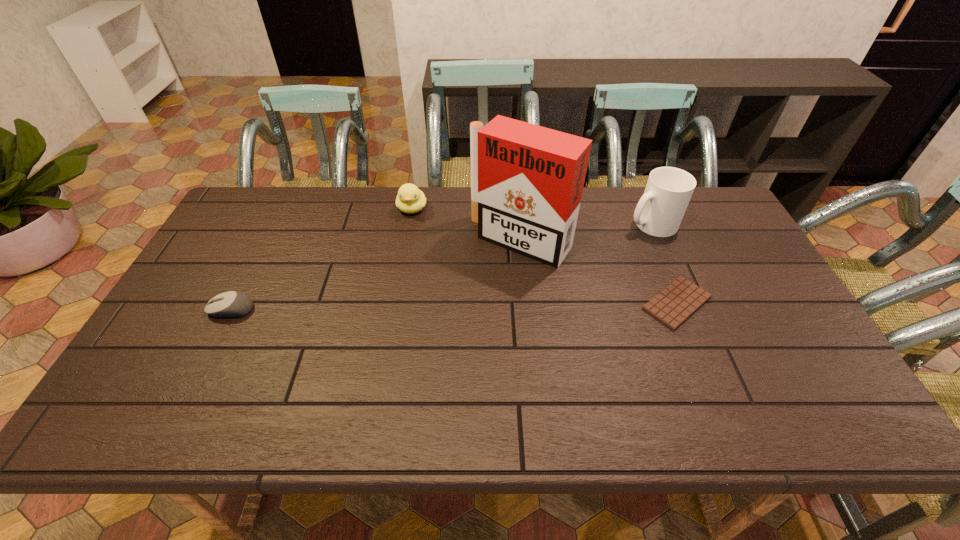
Where is `the second shortest object`? the second shortest object is located at coordinates (231, 304).

Locate an element on the screen. The height and width of the screenshot is (540, 960). computer equipment is located at coordinates (231, 304).

You are a GUI agent. You are given a task and a screenshot of the screen. Output one action in this format:
    pyautogui.click(x=<x>, y=<y>)
    Task: Click on the chocolate bar
    Image resolution: width=960 pixels, height=540 pixels.
    Given the screenshot: What is the action you would take?
    pyautogui.click(x=679, y=300)

Where is `the tallest object`? The width and height of the screenshot is (960, 540). the tallest object is located at coordinates (527, 181).

The image size is (960, 540). In order to click on cigarette case in this screenshot , I will do `click(527, 181)`.

Where is `duckling`? Image resolution: width=960 pixels, height=540 pixels. duckling is located at coordinates click(410, 199).

You are a GUI agent. You are given a task and a screenshot of the screen. Output one action in this format:
    pyautogui.click(x=<x>, y=<y>)
    Task: Click on the third shortest object
    
    Given the screenshot: What is the action you would take?
    410,199

This screenshot has width=960, height=540. I want to click on the second tallest object, so click(x=659, y=212).

I want to click on vacant space located 0.080m on the wheel side of the second shortest object, so click(x=179, y=310).

The height and width of the screenshot is (540, 960). I want to click on vacant point located 0.140m on the front of the shortest object, so click(708, 380).